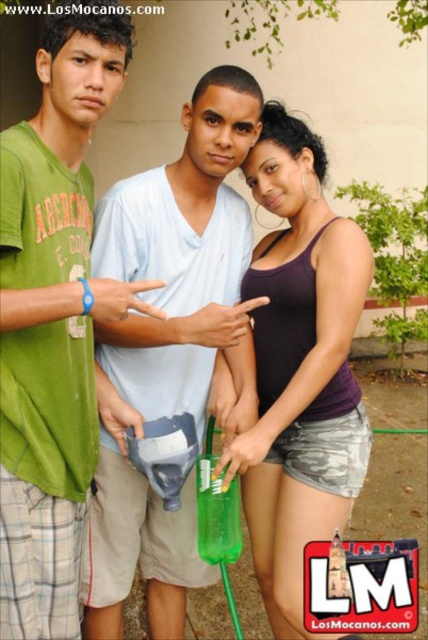
You are standing in the image and want to know if the point at coordinates point (86, 86) is closer to you than the point at point (297, 344). Can you confirm?

Yes, the point at coordinates point (86, 86) is in front of point (297, 344), so it is closer to you.

You are a photographer trying to adjust the lighting for a group photo. Since the green fabric shirt at left and the light blue cotton shirt at center are different in width, which shirt should you focus the light on to ensure both are equally illuminated?

The green fabric shirt at left has a smaller width than the light blue cotton shirt at center. To ensure equal illumination, focus more light on the green fabric shirt at left since it is narrower and might require additional light to match the exposure of the wider light blue cotton shirt at center.

You are a photographer trying to adjust the spacing between the green fabric shirt at left and purple matte tank top at center for a group photo. The current distance between them is 69.56 centimeters. If you want to reduce the distance by half, what should the new distance be?

The current distance between the green fabric shirt at left and purple matte tank top at center is 69.56 centimeters. To reduce it by half, the new distance should be approximately 34.78 centimeters.